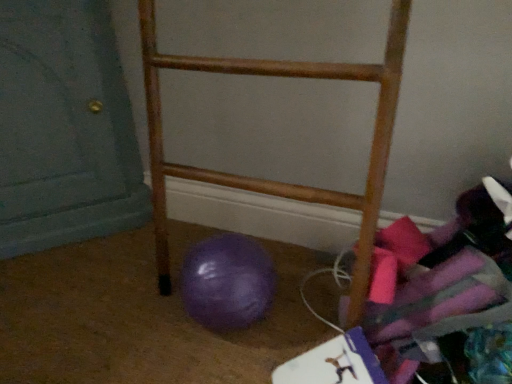
Find the location of a particular element. The height and width of the screenshot is (384, 512). free spot to the right of purple rubber ball at lower left is located at coordinates (311, 294).